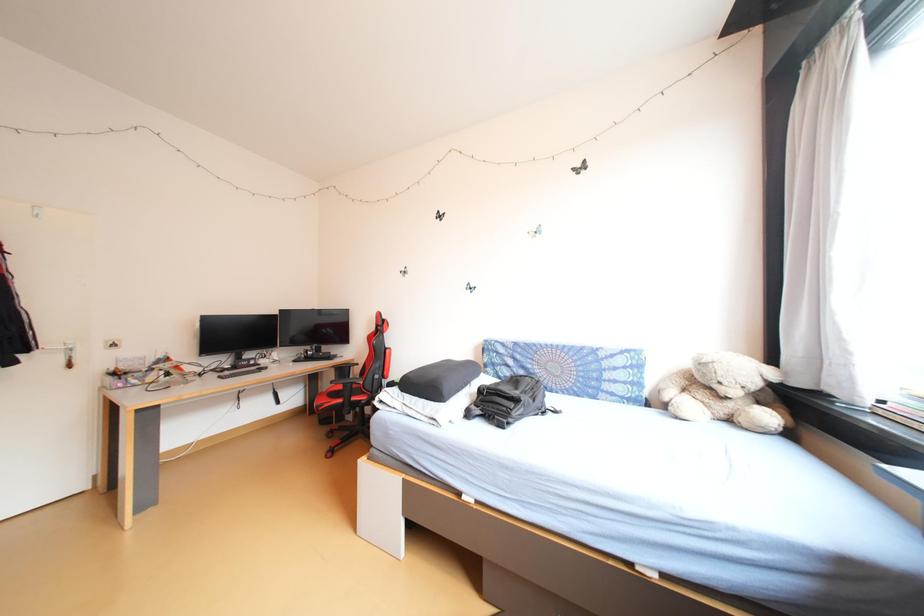
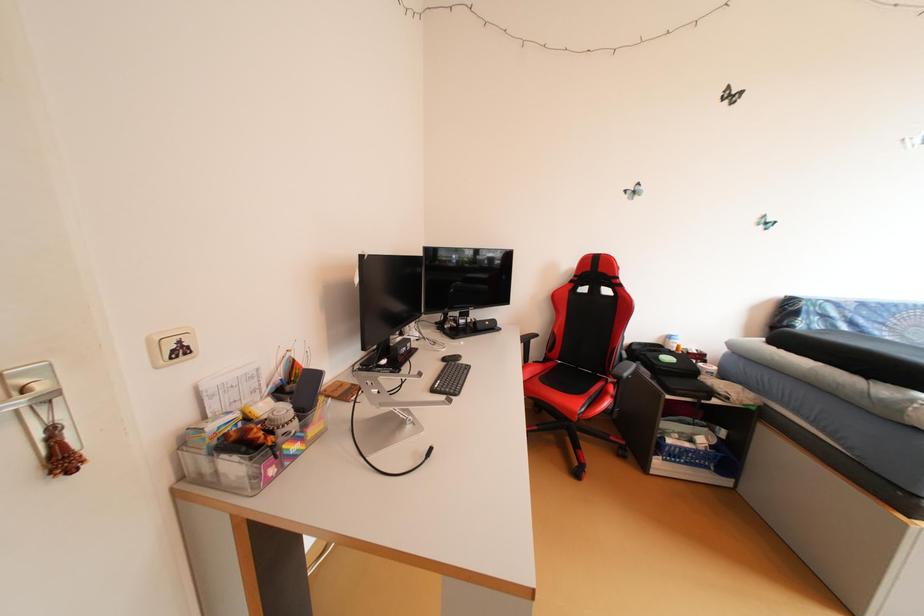
In a continuous first-person perspective shot, in which direction is the camera moving?

The cameraman moved toward left, forward.